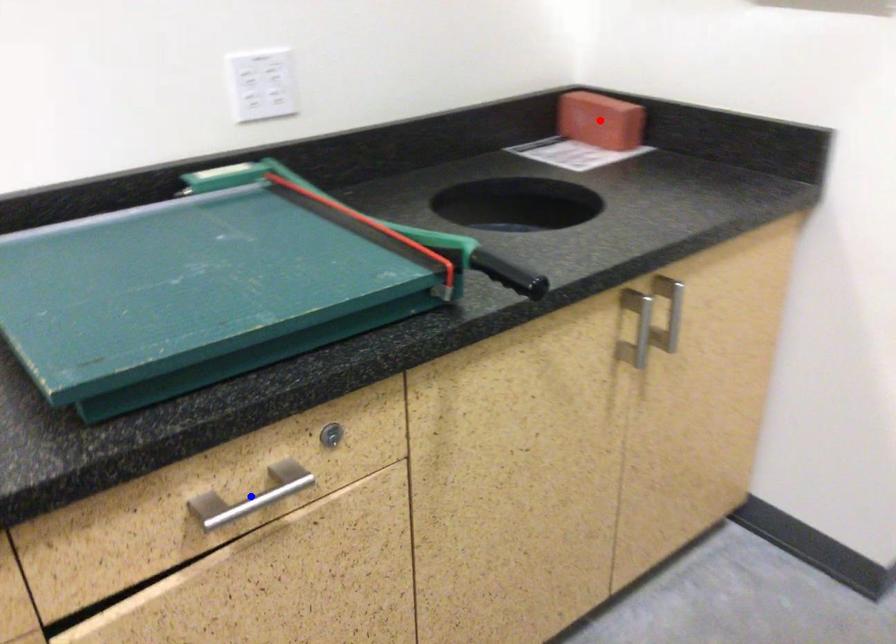
Question: In the image, two points are highlighted. Which point is nearer to the camera? Reply with the corresponding letter.

Choices:
 (A) blue point
 (B) red point

Answer: (A)